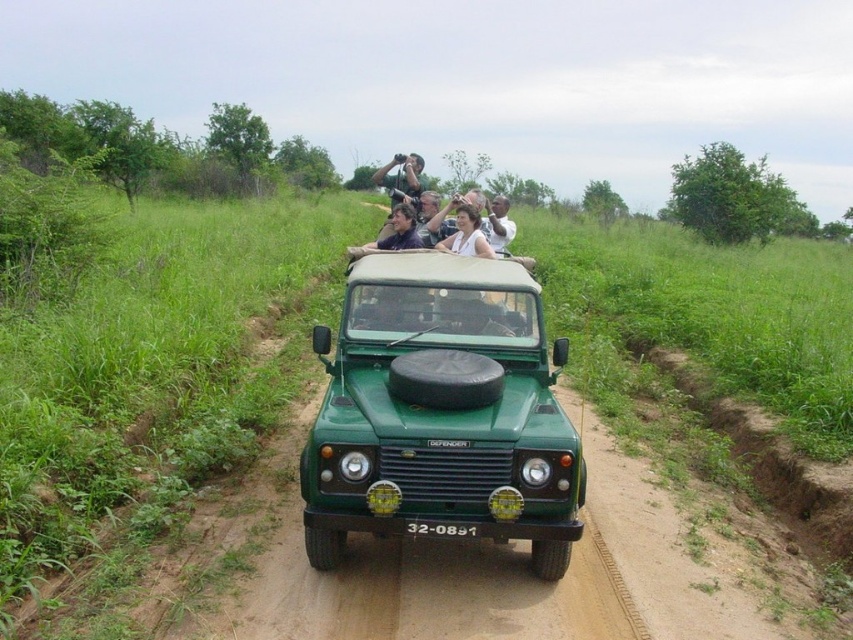
You are a photographer trying to capture a photo of the green matte jeep at center and the matte black camera at center. If you want to include both in your shot, which object should you position closer to the edge of the frame to avoid cropping?

You should position the matte black camera at center closer to the edge of the frame because the green matte jeep at center is to the right of the matte black camera at center, so moving the camera towards the edge would allow both to fit without cropping.

You are a photographer taking a picture of two people in the Land Rover Defender. You notice a white fabric shirt at center and a matte black shirt at center. Which shirt should you focus on if you want to capture the one that is lower in the frame?

The white fabric shirt at center is located below the matte black shirt at center, so you should focus on the white fabric shirt at center to capture the lower one.

You are a photographer standing 5 feet away from the Land Rover Defender. You notice two shirts inside the vehicle at the center. Can you tell if the white fabric shirt at center and the matte black shirt at center are close enough to be captured in a single photo without moving the camera?

The distance between the white fabric shirt at center and the matte black shirt at center is 18.90 inches. Since they are only about 1.57 feet apart and you are 5 feet away from the vehicle, they can likely be captured in a single photo without moving the camera.